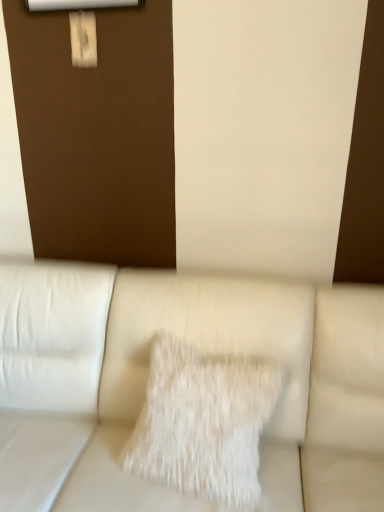
Question: Does white leather couch at center have a smaller size compared to white fluffy pillow at center?

Choices:
 (A) no
 (B) yes

Answer: (A)

Question: Does white leather couch at center lie in front of white fluffy pillow at center?

Choices:
 (A) no
 (B) yes

Answer: (B)

Question: From the image's perspective, does white leather couch at center appear lower than white fluffy pillow at center?

Choices:
 (A) yes
 (B) no

Answer: (A)

Question: Can you confirm if white leather couch at center is bigger than white fluffy pillow at center?

Choices:
 (A) no
 (B) yes

Answer: (B)

Question: Is white leather couch at center aimed at white fluffy pillow at center?

Choices:
 (A) no
 (B) yes

Answer: (B)

Question: Does white leather couch at center appear on the left side of white fluffy pillow at center?

Choices:
 (A) yes
 (B) no

Answer: (A)

Question: Considering the relative positions of white fluffy pillow at center and white leather couch at center in the image provided, is white fluffy pillow at center to the left of white leather couch at center from the viewer's perspective?

Choices:
 (A) yes
 (B) no

Answer: (B)

Question: Can you confirm if white fluffy pillow at center is taller than white leather couch at center?

Choices:
 (A) no
 (B) yes

Answer: (A)

Question: Is white fluffy pillow at center turned away from white leather couch at center?

Choices:
 (A) yes
 (B) no

Answer: (A)

Question: Is white fluffy pillow at center smaller than white leather couch at center?

Choices:
 (A) no
 (B) yes

Answer: (B)

Question: From the image's perspective, is white fluffy pillow at center over white leather couch at center?

Choices:
 (A) yes
 (B) no

Answer: (A)

Question: Considering the relative sizes of white fluffy pillow at center and white leather couch at center in the image provided, is white fluffy pillow at center wider than white leather couch at center?

Choices:
 (A) yes
 (B) no

Answer: (B)

Question: From a real-world perspective, is white leather couch at center positioned above or below white fluffy pillow at center?

Choices:
 (A) below
 (B) above

Answer: (A)